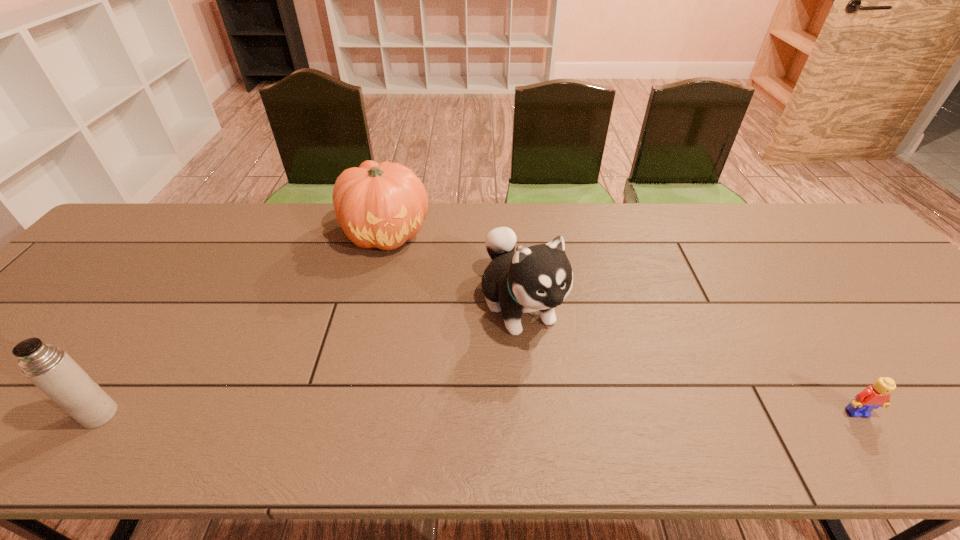
Select which object appears as the second closest to the thermos bottle. Please provide its 2D coordinates. Your answer should be formatted as a tuple, i.e. [(x, y)], where the tuple contains the x and y coordinates of a point satisfying the conditions above.

[(540, 277)]

The width and height of the screenshot is (960, 540). Identify the location of the closest object to the leftmost object. (383, 205).

Identify the location of free space that satisfies the following two spatial constraints: 1. on the front side of the third object from right to left; 2. on the left side of the puppy. This screenshot has width=960, height=540. pos(367,305).